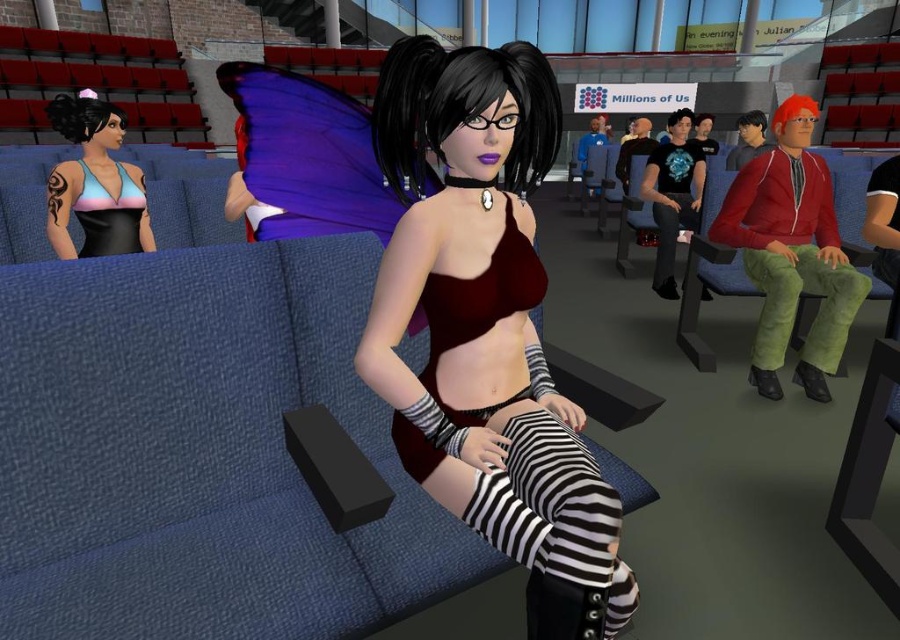
Who is shorter, velvet maroon top at center or green fuzzy pants at right?

green fuzzy pants at right is shorter.

Is point (492, 422) less distant than point (812, 339)?

Yes, it is in front of point (812, 339).

Where is `velvet maroon top at center`? Image resolution: width=900 pixels, height=640 pixels. velvet maroon top at center is located at coordinates (483, 316).

Identify the location of velvet maroon top at center. pyautogui.click(x=483, y=316).

Does green fuzzy pants at right have a lesser width compared to black leather pants at center?

Indeed, green fuzzy pants at right has a lesser width compared to black leather pants at center.

In the scene shown: Does green fuzzy pants at right come behind black leather pants at center?

No, green fuzzy pants at right is in front of black leather pants at center.

Is point (754, 260) positioned in front of point (657, 291)?

Yes, point (754, 260) is in front of point (657, 291).

Locate an element on the screen. This screenshot has height=640, width=900. green fuzzy pants at right is located at coordinates (797, 304).

Is point (510, 253) in front of point (100, 225)?

That is True.

Image resolution: width=900 pixels, height=640 pixels. What do you see at coordinates (480, 310) in the screenshot?
I see `satin burgundy dress at center` at bounding box center [480, 310].

Who is more forward, (477,282) or (96,216)?

Point (477,282) is more forward.

The height and width of the screenshot is (640, 900). What are the coordinates of `satin burgundy dress at center` in the screenshot? It's located at (480, 310).